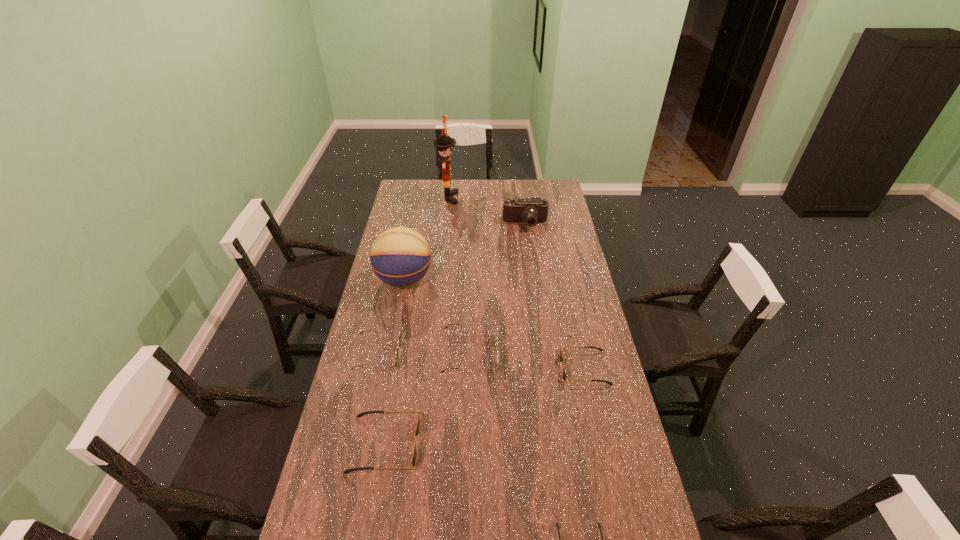
This screenshot has height=540, width=960. What are the coordinates of `green sunglasses that is the second closest to the smallest black sunglasses` in the screenshot? It's located at pos(496,323).

The height and width of the screenshot is (540, 960). What are the coordinates of `green sunglasses that is the closest to the smallest black sunglasses` in the screenshot? It's located at (432, 539).

Where is `black sunglasses that is the third closest to the third tallest object`? black sunglasses that is the third closest to the third tallest object is located at coordinates (556, 523).

Where is `black sunglasses that is the closest one to the farthest object`? This screenshot has height=540, width=960. black sunglasses that is the closest one to the farthest object is located at coordinates (561, 358).

This screenshot has width=960, height=540. What are the coordinates of `vacant region that satisfies the following two spatial constraints: 1. on the front-facing side of the second farthest object; 2. on the front-facing side of the biggest green sunglasses` in the screenshot? It's located at (543, 353).